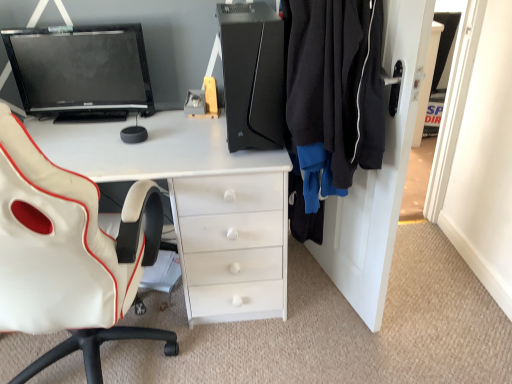
Question: Is white leather chair at left located outside matte black monitor at upper left?

Choices:
 (A) no
 (B) yes

Answer: (B)

Question: Would you say white leather chair at left is a long distance from matte black monitor at upper left?

Choices:
 (A) no
 (B) yes

Answer: (A)

Question: Is white leather chair at left behind matte black monitor at upper left?

Choices:
 (A) yes
 (B) no

Answer: (B)

Question: Is white leather chair at left to the right of matte black monitor at upper left from the viewer's perspective?

Choices:
 (A) no
 (B) yes

Answer: (B)

Question: Is white leather chair at left shorter than matte black monitor at upper left?

Choices:
 (A) yes
 (B) no

Answer: (B)

Question: Would you say white glossy desk at center is to the left or to the right of black matte dresser at right in the picture?

Choices:
 (A) right
 (B) left

Answer: (B)

Question: Does point (164, 137) appear closer or farther from the camera than point (333, 198)?

Choices:
 (A) farther
 (B) closer

Answer: (B)

Question: From a real-world perspective, is white glossy desk at center above or below black matte dresser at right?

Choices:
 (A) below
 (B) above

Answer: (A)

Question: Which is correct: white glossy desk at center is inside black matte dresser at right, or outside of it?

Choices:
 (A) outside
 (B) inside

Answer: (A)

Question: From their relative heights in the image, would you say white glossy desk at center is taller or shorter than black matte computer tower at center?

Choices:
 (A) short
 (B) tall

Answer: (B)

Question: Which is correct: white glossy desk at center is inside black matte computer tower at center, or outside of it?

Choices:
 (A) inside
 (B) outside

Answer: (B)

Question: Is white glossy desk at center in front of or behind black matte computer tower at center in the image?

Choices:
 (A) behind
 (B) front

Answer: (A)

Question: From the image's perspective, is white glossy desk at center located above or below black matte computer tower at center?

Choices:
 (A) below
 (B) above

Answer: (A)

Question: Looking at their shapes, would you say black fleece jacket at right is wider or thinner than white leather chair at left?

Choices:
 (A) wide
 (B) thin

Answer: (B)

Question: From a real-world perspective, is black fleece jacket at right above or below white leather chair at left?

Choices:
 (A) above
 (B) below

Answer: (A)